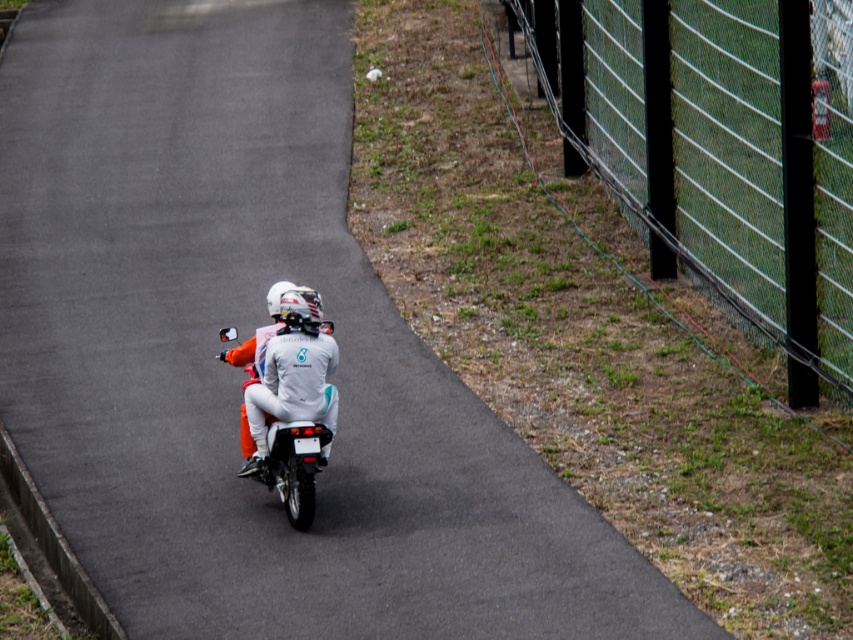
Is point (267, 346) closer to camera compared to point (265, 472)?

Yes, point (267, 346) is closer to viewer.

Where is `white matte helmet at center`? white matte helmet at center is located at coordinates (292, 372).

Is green mesh fence at right thinner than white matte helmet at center?

Indeed, green mesh fence at right has a lesser width compared to white matte helmet at center.

Does point (672, 13) come closer to viewer compared to point (241, 470)?

No, (672, 13) is behind (241, 470).

At what (x,y) coordinates should I click in order to perform the action: click on green mesh fence at right. Please return your answer as a coordinate pair (x, y). The width and height of the screenshot is (853, 640). Looking at the image, I should click on (717, 152).

Between green mesh fence at right and white matte motorcycle at center, which one appears on the right side from the viewer's perspective?

From the viewer's perspective, green mesh fence at right appears more on the right side.

Locate an element on the screen. This screenshot has height=640, width=853. green mesh fence at right is located at coordinates point(717,152).